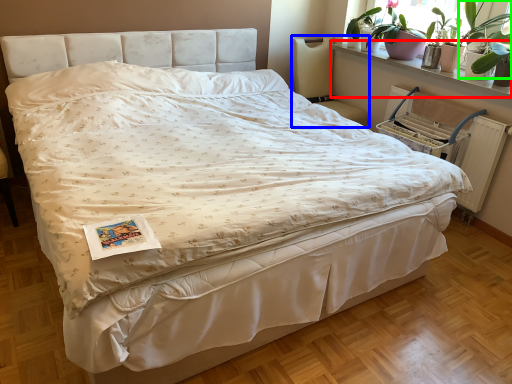
Question: Based on their relative distances, which object is farther from window sill (highlighted by a red box)? Choose from chair (highlighted by a blue box) and plant (highlighted by a green box).

Choices:
 (A) chair
 (B) plant

Answer: (A)